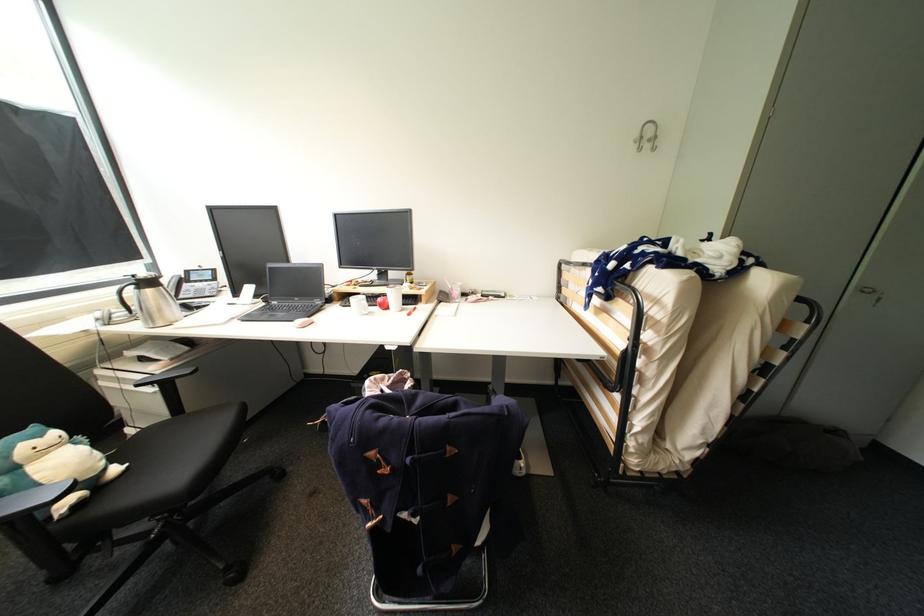
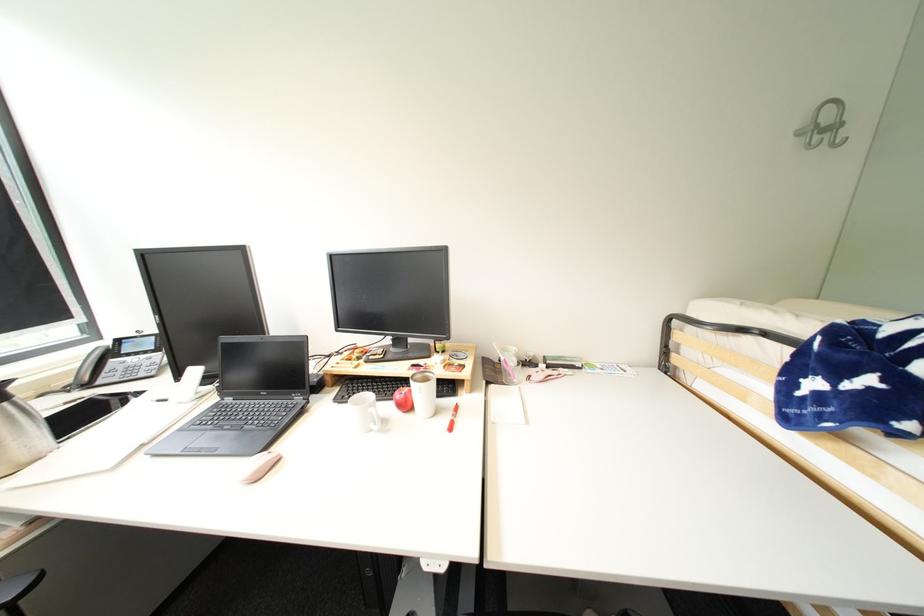
In a continuous first-person perspective shot, in which direction is the camera moving?

The movement direction of the cameraman is left, forward.